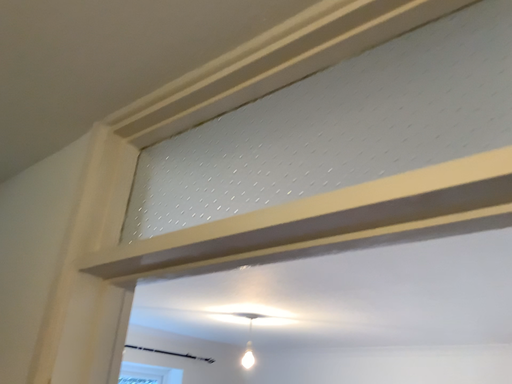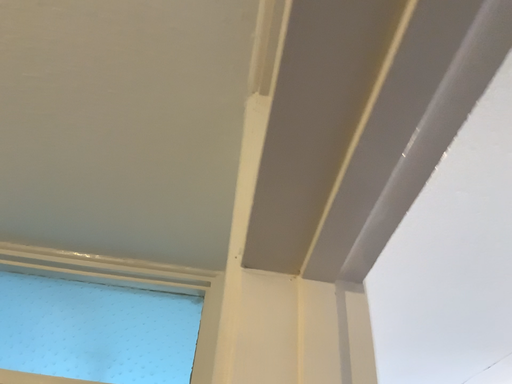
Question: How did the camera likely rotate when shooting the video?

Choices:
 (A) rotated right
 (B) rotated left

Answer: (B)